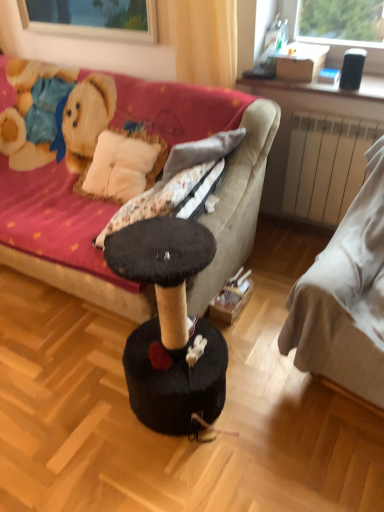
This screenshot has width=384, height=512. I want to click on vacant space positioned to the left of white fabric bed at right, acting as the first studio couch starting from the right, so click(247, 378).